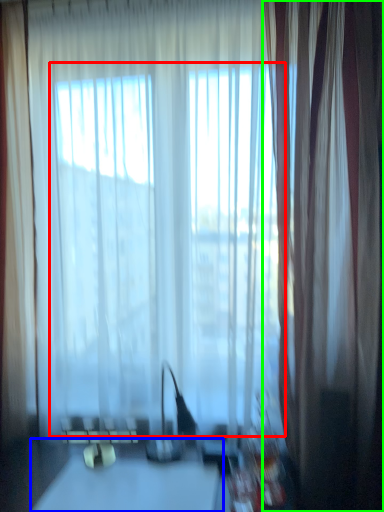
Question: Which object is the farthest from bay window (highlighted by a red box)? Choose among these: table (highlighted by a blue box) or curtain (highlighted by a green box).

Choices:
 (A) table
 (B) curtain

Answer: (A)